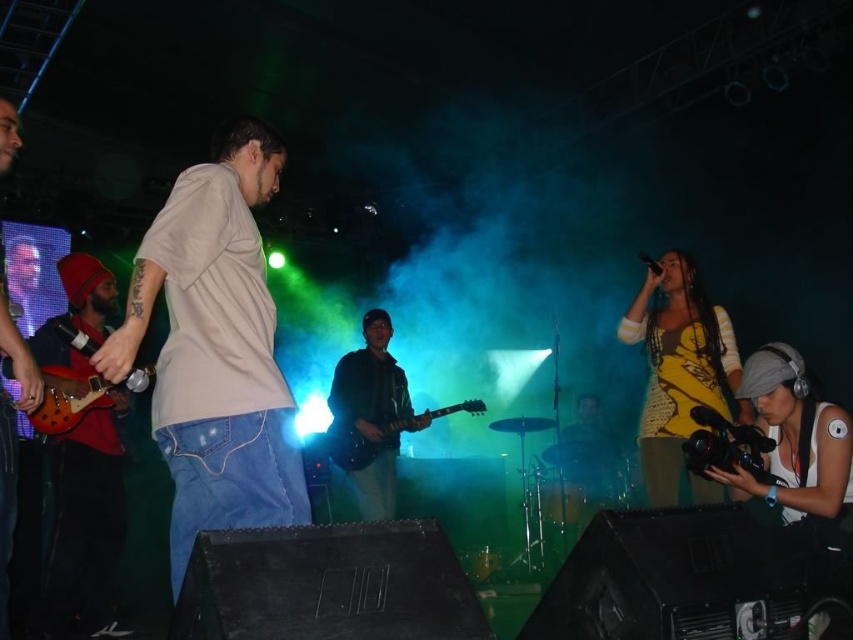
Is shiny red guitar at left shorter than yellow crochet top at center?

No.

Is shiny red guitar at left smaller than yellow crochet top at center?

No.

Which is behind, point (70, 358) or point (712, 314)?

Point (70, 358)

Identify the location of shiny red guitar at left. (85, 524).

Who is more distant from viewer, (352, 433) or (381, 440)?

The point (352, 433) is behind.

This screenshot has width=853, height=640. Find the location of `shiny black guitar at center`. shiny black guitar at center is located at coordinates (370, 417).

Between shiny red guitar at left and shiny wood electric guitar at left, which one has more height?

shiny red guitar at left

Locate an element on the screen. Image resolution: width=853 pixels, height=640 pixels. shiny red guitar at left is located at coordinates (85, 524).